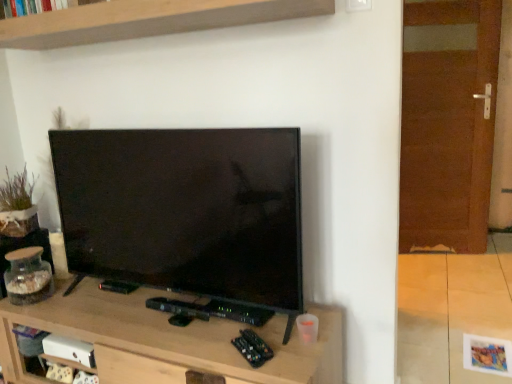
This screenshot has height=384, width=512. What do you see at coordinates (448, 122) in the screenshot?
I see `brown wooden door at right` at bounding box center [448, 122].

Identify the location of clear glass jar at left. This screenshot has width=512, height=384. (28, 276).

Locate an element on the screen. This screenshot has width=512, height=384. brown wooden door at right is located at coordinates (448, 122).

The height and width of the screenshot is (384, 512). Identify the location of glass door below the wooden shelf at upper center (from the image's perspective). (448, 122).

Considering the positions of point (305, 9) and point (466, 190), is point (305, 9) closer or farther from the camera than point (466, 190)?

Point (305, 9) is positioned closer to the camera compared to point (466, 190).

From the image's perspective, between wooden shelf at upper center and brown wooden door at right, which one is located above?

wooden shelf at upper center, from the image's perspective.

In terms of size, does wooden shelf at upper center appear bigger or smaller than brown wooden door at right?

wooden shelf at upper center is smaller than brown wooden door at right.

Which of these two, wooden tv stand at center or wooden shelf at upper center, stands shorter?

wooden shelf at upper center.

From the picture: Is wooden tv stand at center bigger than wooden shelf at upper center?

Yes, wooden tv stand at center is bigger than wooden shelf at upper center.

Is wooden tv stand at center wider or thinner than wooden shelf at upper center?

Considering their sizes, wooden tv stand at center looks broader than wooden shelf at upper center.

What's the angular difference between wooden tv stand at center and wooden shelf at upper center's facing directions?

The facing directions of wooden tv stand at center and wooden shelf at upper center are 2.55 degrees apart.

Do you think clear glass jar at left is within brown wooden door at right, or outside of it?

clear glass jar at left exists outside the volume of brown wooden door at right.

From the image's perspective, which is above, clear glass jar at left or brown wooden door at right?

brown wooden door at right, from the image's perspective.

Measure the distance from clear glass jar at left to brown wooden door at right.

clear glass jar at left is 2.56 meters from brown wooden door at right.

Does point (129, 361) appear closer or farther from the camera than point (30, 283)?

Point (129, 361) is closer to the camera than point (30, 283).

Can you confirm if wooden tv stand at center is taller than clear glass jar at left?

Indeed, wooden tv stand at center has a greater height compared to clear glass jar at left.

From a real-world perspective, is wooden tv stand at center below clear glass jar at left?

Indeed, from a real-world perspective, wooden tv stand at center is positioned beneath clear glass jar at left.

Is wooden tv stand at center completely or partially inside clear glass jar at left?

No, clear glass jar at left does not contain wooden tv stand at center.

From a real-world perspective, between clear glass jar at left and wooden tv stand at center, who is vertically higher?

clear glass jar at left, from a real-world perspective.

Considering the positions of points (17, 267) and (333, 355), is point (17, 267) closer to camera compared to point (333, 355)?

No, (17, 267) is behind (333, 355).

Is clear glass jar at left wider than wooden tv stand at center?

In fact, clear glass jar at left might be narrower than wooden tv stand at center.

Considering the sizes of objects clear glass jar at left and wooden shelf at upper center in the image provided, who is wider, clear glass jar at left or wooden shelf at upper center?

wooden shelf at upper center is wider.

From a real-world perspective, which is physically below, clear glass jar at left or wooden shelf at upper center?

In real-world perspective, clear glass jar at left is lower.

Between clear glass jar at left and wooden shelf at upper center, which one is positioned behind?

clear glass jar at left.

Looking at the image, does clear glass jar at left seem bigger or smaller compared to wooden shelf at upper center?

In the image, clear glass jar at left appears to be smaller than wooden shelf at upper center.

Does wooden tv stand at center appear on the left side of brown wooden door at right?

Correct, you'll find wooden tv stand at center to the left of brown wooden door at right.

Can you tell me how much wooden tv stand at center and brown wooden door at right differ in facing direction?

14.8 degrees separate the facing orientations of wooden tv stand at center and brown wooden door at right.

Is wooden tv stand at center positioned with its back to brown wooden door at right?

That's not correct — wooden tv stand at center is not looking away from brown wooden door at right.

Does point (143, 351) come behind point (468, 66)?

No, (143, 351) is in front of (468, 66).

Where is `glass door below the wooden shelf at upper center (from the image's perspective)`? glass door below the wooden shelf at upper center (from the image's perspective) is located at coordinates (448, 122).

Identify the location of shelf located in front of the wooden tv stand at center. (146, 20).

From the image, which object appears to be nearer to wooden tv stand at center, clear glass jar at left or brown wooden door at right?

The object closer to wooden tv stand at center is clear glass jar at left.

When comparing their distances from brown wooden door at right, does wooden tv stand at center or clear glass jar at left seem closer?

wooden tv stand at center lies closer to brown wooden door at right than the other object.

Considering their positions, is clear glass jar at left positioned further to wooden shelf at upper center than wooden tv stand at center?

wooden tv stand at center is further to wooden shelf at upper center.

Based on their spatial positions, is wooden shelf at upper center or clear glass jar at left further from brown wooden door at right?

Among the two, clear glass jar at left is located further to brown wooden door at right.

Considering their positions, is wooden tv stand at center positioned closer to wooden shelf at upper center than brown wooden door at right?

wooden tv stand at center.

When comparing their distances from wooden tv stand at center, does brown wooden door at right or wooden shelf at upper center seem closer?

wooden shelf at upper center is positioned closer to the anchor wooden tv stand at center.

Based on their spatial positions, is wooden shelf at upper center or brown wooden door at right closer to wooden tv stand at center?

wooden shelf at upper center.

Which object lies nearer to the anchor point wooden shelf at upper center, clear glass jar at left or brown wooden door at right?

Among the two, clear glass jar at left is located nearer to wooden shelf at upper center.

Identify the location of shelf situated between clear glass jar at left and brown wooden door at right from left to right. This screenshot has width=512, height=384. (x=146, y=20).

What are the coordinates of `table between clear glass jar at left and brown wooden door at right` in the screenshot? It's located at (169, 340).

Find the location of a particular element. This screenshot has height=384, width=512. glass jar between wooden shelf at upper center and wooden tv stand at center in the up-down direction is located at coordinates (28, 276).

The image size is (512, 384). What are the coordinates of `table situated between wooden shelf at upper center and brown wooden door at right from left to right` in the screenshot? It's located at (169, 340).